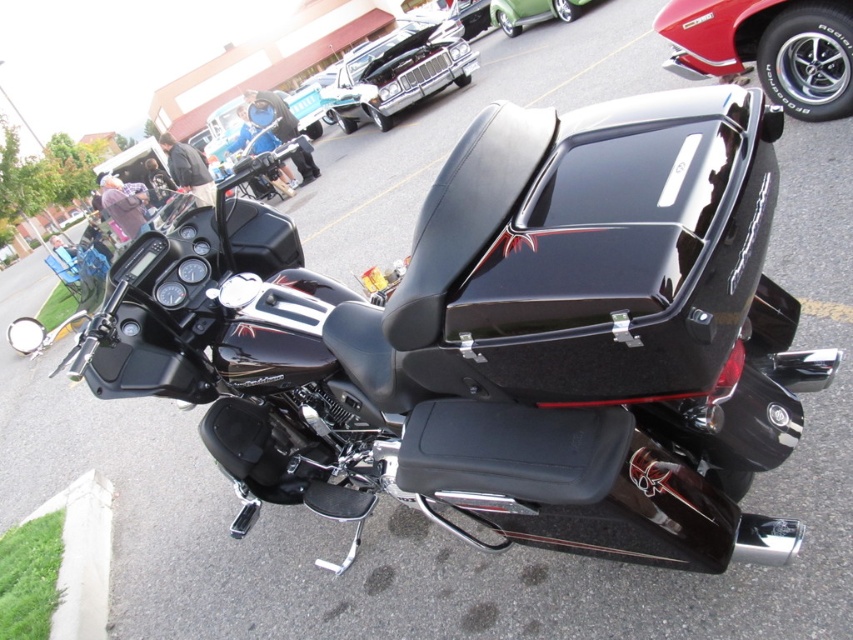
You are a photographer setting up a tripod to capture the glossy red car at upper right and the green grass at lower left. Which object will appear taller in the photo?

The glossy red car at upper right will appear taller in the photo because it has a greater height compared to the green grass at lower left.

You are at a car show and want to take a photo of both the glossy red car at upper right and the shiny chrome car at upper center. Which car should you focus on first to ensure both are in the frame?

You should focus on the shiny chrome car at upper center first because the glossy red car at upper right is closer to the viewer, so adjusting the camera to include both would require framing starting from the closer car and expanding outward to include the farther one.